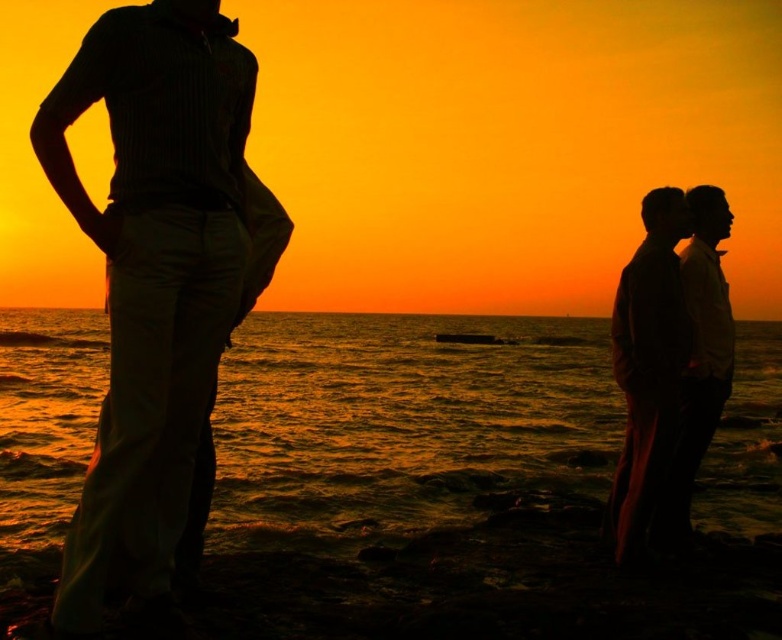
Does shiny metallic water at center have a larger size compared to silhouette couple at right?

Yes.

Who is positioned more to the left, shiny metallic water at center or silhouette couple at right?

Positioned to the left is shiny metallic water at center.

This screenshot has height=640, width=782. In order to click on shiny metallic water at center in this screenshot , I will do pos(402,424).

Does point (106, 108) lie behind point (691, 483)?

No, (106, 108) is in front of (691, 483).

Does point (131, 234) come behind point (714, 212)?

No, (131, 234) is closer to viewer.

You are a GUI agent. You are given a task and a screenshot of the screen. Output one action in this format:
    pyautogui.click(x=<x>, y=<y>)
    Task: Click on the silhouette pants at left
    
    Given the screenshot: What is the action you would take?
    pyautogui.click(x=152, y=275)

Can you confirm if silhouette couple at right is shorter than silhouette shirt at right?

No.

Between point (632, 496) and point (675, 500), which one is positioned behind?

The point (675, 500) is more distant.

The width and height of the screenshot is (782, 640). I want to click on silhouette couple at right, so click(662, 365).